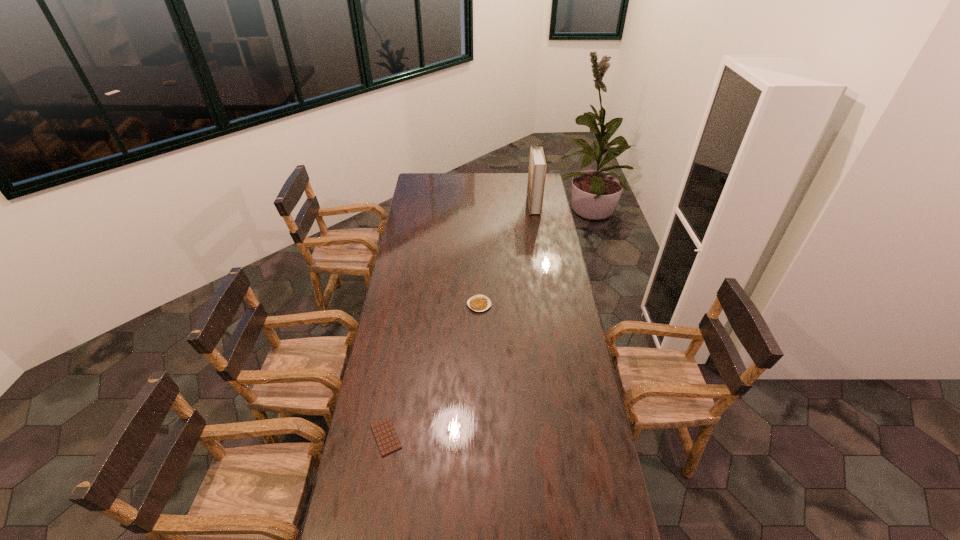
Locate an element on the screen. This screenshot has height=540, width=960. vacant area situated on the front of the chocolate bar is located at coordinates (378, 481).

At what (x,y) coordinates should I click in order to perform the action: click on object at the left edge. Please return your answer as a coordinate pair (x, y). This screenshot has width=960, height=540. Looking at the image, I should click on (387, 440).

Where is `object at the right edge`? object at the right edge is located at coordinates (537, 164).

Find the location of a particular element. free region at the far edge is located at coordinates (508, 175).

The image size is (960, 540). What are the coordinates of `vacant space at the left edge of the desktop` in the screenshot? It's located at (x=355, y=492).

I want to click on free location at the right edge, so click(x=548, y=307).

In the image, there is a desktop. Identify the location of blank space at the far left corner. (435, 192).

Identify the location of vacant area that lies between the second nearest object and the phonebook. (507, 255).

Identify the location of blank region between the shortest object and the tallest object. (460, 321).

This screenshot has width=960, height=540. What are the coordinates of `unoccupied position between the second shortest object and the tallest object` in the screenshot? It's located at (507, 255).